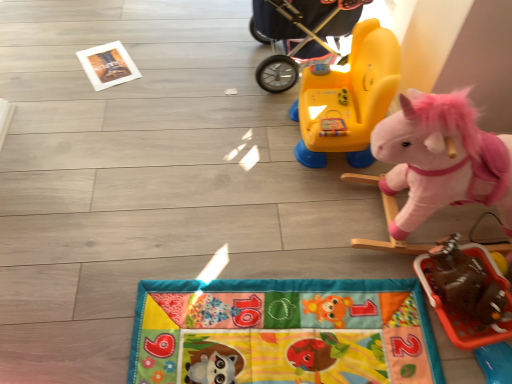
Find the location of a particular element. free spot to the left of brown fuzzy elephant at lower right, which is the third toy from top to bottom is located at coordinates (395, 313).